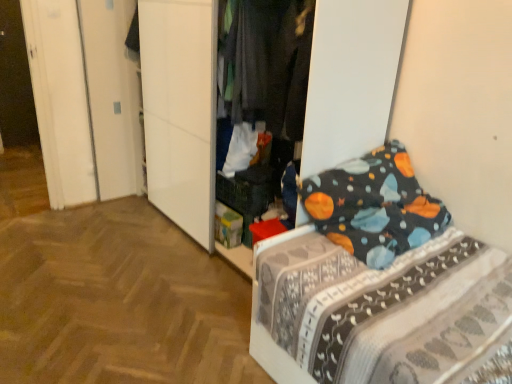
Question: Can we say dark gray fabric pants at center lies outside dark blue fabric bed at right?

Choices:
 (A) yes
 (B) no

Answer: (A)

Question: Does dark gray fabric pants at center have a greater height compared to dark blue fabric bed at right?

Choices:
 (A) yes
 (B) no

Answer: (A)

Question: From the image's perspective, is dark gray fabric pants at center located above dark blue fabric bed at right?

Choices:
 (A) yes
 (B) no

Answer: (A)

Question: Is dark blue fabric bed at right surrounded by dark gray fabric pants at center?

Choices:
 (A) yes
 (B) no

Answer: (B)

Question: Does dark gray fabric pants at center have a smaller size compared to dark blue fabric bed at right?

Choices:
 (A) no
 (B) yes

Answer: (B)

Question: Is dark gray fabric pants at center facing away from dark blue fabric bed at right?

Choices:
 (A) no
 (B) yes

Answer: (A)

Question: Is dark blue fabric bed at right not within dark gray fabric pants at center?

Choices:
 (A) no
 (B) yes

Answer: (B)

Question: From a real-world perspective, is dark blue fabric bed at right on top of dark gray fabric pants at center?

Choices:
 (A) yes
 (B) no

Answer: (B)

Question: Can you confirm if dark blue fabric bed at right is shorter than dark gray fabric pants at center?

Choices:
 (A) no
 (B) yes

Answer: (B)

Question: Does dark blue fabric bed at right come in front of dark gray fabric pants at center?

Choices:
 (A) no
 (B) yes

Answer: (B)

Question: From a real-world perspective, is dark blue fabric bed at right physically below dark gray fabric pants at center?

Choices:
 (A) yes
 (B) no

Answer: (A)

Question: Does dark blue fabric bed at right appear on the right side of dark gray fabric pants at center?

Choices:
 (A) yes
 (B) no

Answer: (A)

Question: Looking at their shapes, would you say dark gray fabric pants at center is wider or thinner than dark blue fabric bed at right?

Choices:
 (A) thin
 (B) wide

Answer: (A)